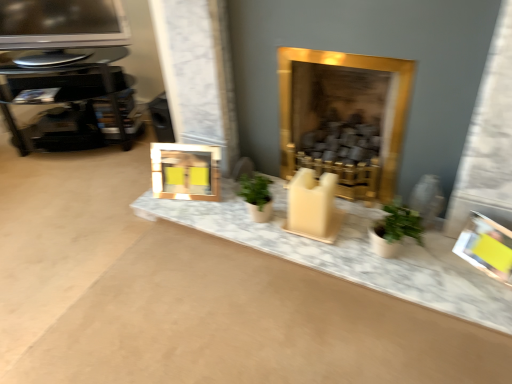
At what (x,y) coordinates should I click in order to perform the action: click on vacant area on top of marble counter top at center (from a real-world perspective). Please return your answer as a coordinate pair (x, y). Looking at the image, I should click on (336, 234).